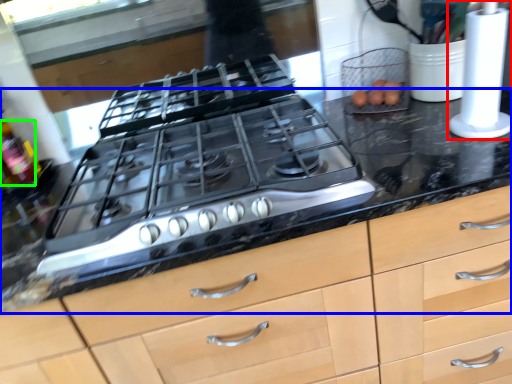
Question: Which object is the farthest from kitchen appliance (highlighted by a red box)? Choose among these: countertop (highlighted by a blue box) or bottle (highlighted by a green box).

Choices:
 (A) countertop
 (B) bottle

Answer: (B)